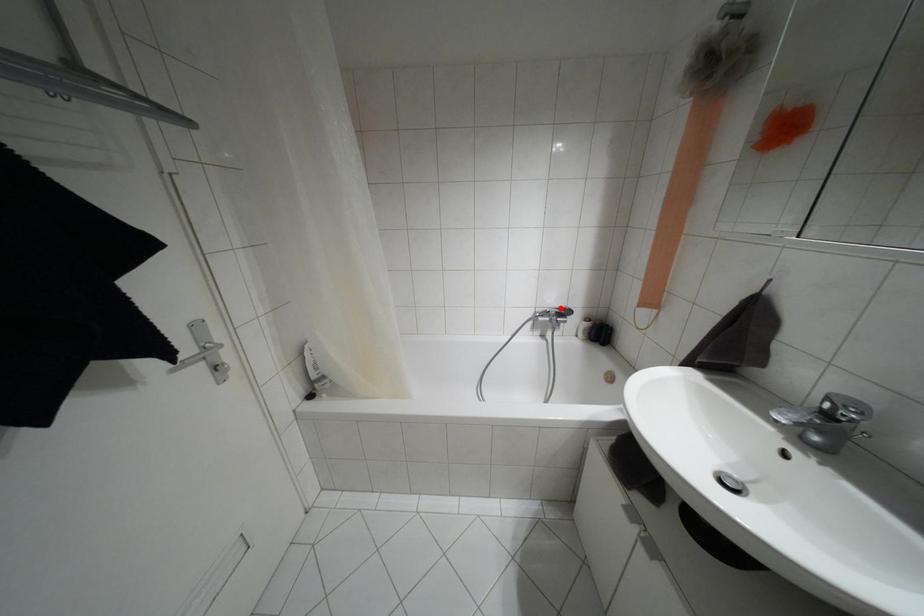
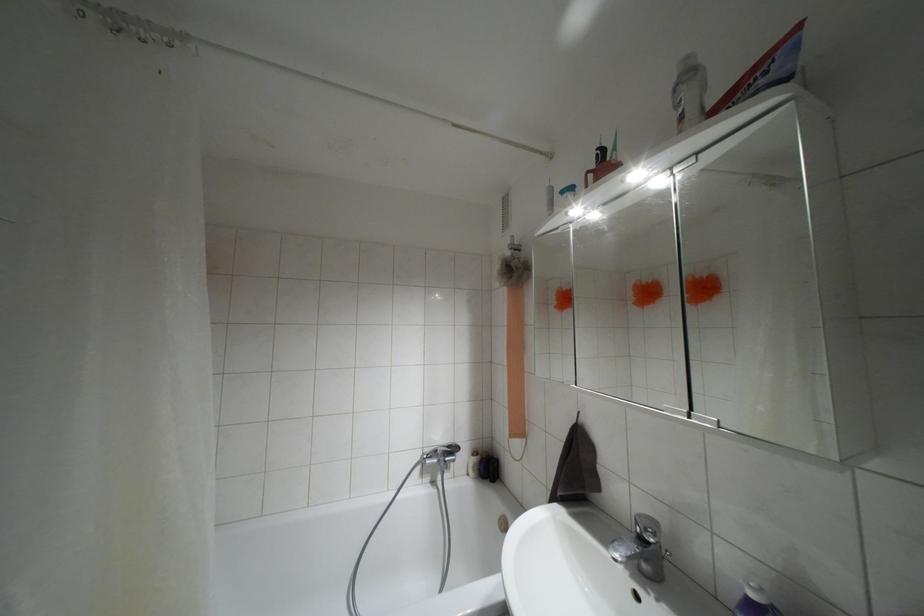
Question: I am providing you with two images of the same scene from different viewpoints. In image1, a red point is highlighted. Considering the same 3D point in image2, which of the following is correct?

Choices:
 (A) It is closer
 (B) It is farther

Answer: (B)